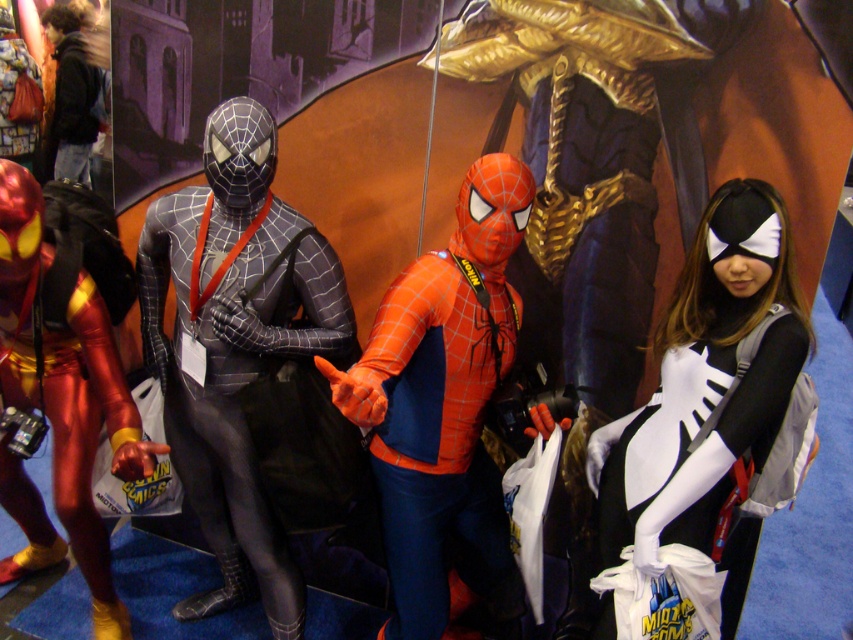
Looking at this image, between shiny metallic suit at left and matte black jacket at upper left, which one has more height?

shiny metallic suit at left is taller.

The height and width of the screenshot is (640, 853). What do you see at coordinates (67, 384) in the screenshot? I see `shiny metallic suit at left` at bounding box center [67, 384].

Find the location of `shiny metallic suit at left`. shiny metallic suit at left is located at coordinates (67, 384).

Is white matte spider suit at right smaller than matte black jacket at upper left?

Actually, white matte spider suit at right might be larger than matte black jacket at upper left.

Between white matte spider suit at right and matte black jacket at upper left, which one is positioned higher?

matte black jacket at upper left

Between point (633, 490) and point (59, 177), which one is positioned behind?

Point (59, 177)

Where is `white matte spider suit at right`? The height and width of the screenshot is (640, 853). white matte spider suit at right is located at coordinates (693, 435).

Is shiny metallic suit at left positioned at the back of white matte spider suit at right?

That is True.

How far apart are shiny metallic suit at left and white matte spider suit at right?

shiny metallic suit at left and white matte spider suit at right are 4.41 feet apart from each other.

Is point (64, 486) positioned before point (675, 413)?

No, (64, 486) is behind (675, 413).

Identify the location of shiny metallic suit at left. (67, 384).